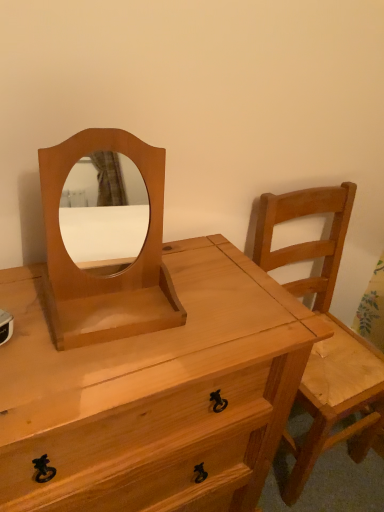
Question: From the image's perspective, is light brown wooden chair at right beneath natural wood chest of drawers at center?

Choices:
 (A) yes
 (B) no

Answer: (B)

Question: Considering the relative sizes of light brown wooden chair at right and natural wood chest of drawers at center in the image provided, is light brown wooden chair at right thinner than natural wood chest of drawers at center?

Choices:
 (A) yes
 (B) no

Answer: (A)

Question: From a real-world perspective, is light brown wooden chair at right positioned over natural wood chest of drawers at center based on gravity?

Choices:
 (A) no
 (B) yes

Answer: (B)

Question: Does light brown wooden chair at right come in front of natural wood chest of drawers at center?

Choices:
 (A) no
 (B) yes

Answer: (A)

Question: Is light brown wooden chair at right oriented towards natural wood chest of drawers at center?

Choices:
 (A) no
 (B) yes

Answer: (A)

Question: Considering the relative sizes of light brown wooden chair at right and natural wood chest of drawers at center in the image provided, is light brown wooden chair at right taller than natural wood chest of drawers at center?

Choices:
 (A) yes
 (B) no

Answer: (A)

Question: Considering the relative sizes of natural wood chest of drawers at center and light brown wooden chair at right in the image provided, is natural wood chest of drawers at center taller than light brown wooden chair at right?

Choices:
 (A) no
 (B) yes

Answer: (A)

Question: Does natural wood chest of drawers at center have a greater width compared to light brown wooden chair at right?

Choices:
 (A) yes
 (B) no

Answer: (A)

Question: Is natural wood chest of drawers at center at the right side of light brown wooden chair at right?

Choices:
 (A) no
 (B) yes

Answer: (A)

Question: Is natural wood chest of drawers at center outside light brown wooden chair at right?

Choices:
 (A) yes
 (B) no

Answer: (A)

Question: From a real-world perspective, is natural wood chest of drawers at center located higher than light brown wooden chair at right?

Choices:
 (A) no
 (B) yes

Answer: (A)

Question: From the image's perspective, does natural wood chest of drawers at center appear lower than light brown wooden chair at right?

Choices:
 (A) no
 (B) yes

Answer: (B)

Question: Is light brown wood mirror at center completely or partially outside of natural wood chest of drawers at center?

Choices:
 (A) no
 (B) yes

Answer: (B)